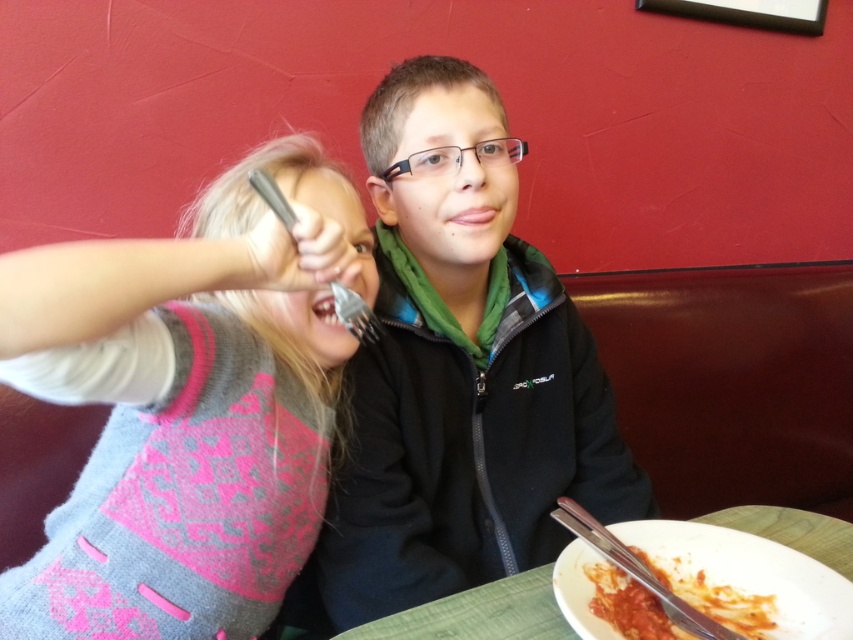
How far apart are knitted sweater at left and tomato sauce pasta at lower right?

They are 17.89 inches apart.

Is knitted sweater at left below tomato sauce pasta at lower right?

No, knitted sweater at left is not below tomato sauce pasta at lower right.

You are a GUI agent. You are given a task and a screenshot of the screen. Output one action in this format:
    pyautogui.click(x=<x>, y=<y>)
    Task: Click on the knitted sweater at left
    
    Given the screenshot: What is the action you would take?
    pyautogui.click(x=184, y=470)

At what (x,y) coordinates should I click in order to perform the action: click on knitted sweater at left. Please return your answer as a coordinate pair (x, y). Looking at the image, I should click on (184, 470).

Who is taller, black matte jacket at center or knitted sweater at left?

black matte jacket at center is taller.

Is black matte jacket at center below knitted sweater at left?

No, black matte jacket at center is not below knitted sweater at left.

Which is in front, point (558, 408) or point (222, 189)?

Positioned in front is point (222, 189).

Identify the location of black matte jacket at center. (461, 369).

Which is more to the left, knitted sweater at left or green wooden table at lower right?

Positioned to the left is knitted sweater at left.

Is knitted sweater at left smaller than green wooden table at lower right?

No.

Is point (202, 467) positioned before point (354, 637)?

No, (202, 467) is further to viewer.

The image size is (853, 640). Find the location of `knitted sweater at left`. knitted sweater at left is located at coordinates (184, 470).